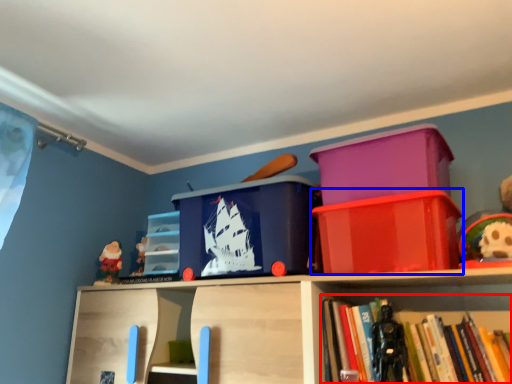
Question: Which of the following is the farthest to the observer, book (highlighted by a red box) or storage box (highlighted by a blue box)?

Choices:
 (A) book
 (B) storage box

Answer: (B)